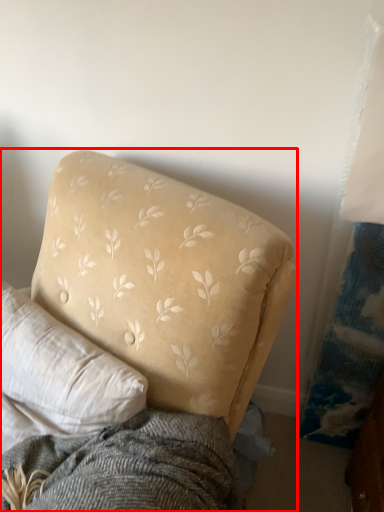
Question: From the image's perspective, where is studio couch (annotated by the red box) located relative to pillow?

Choices:
 (A) below
 (B) above

Answer: (A)